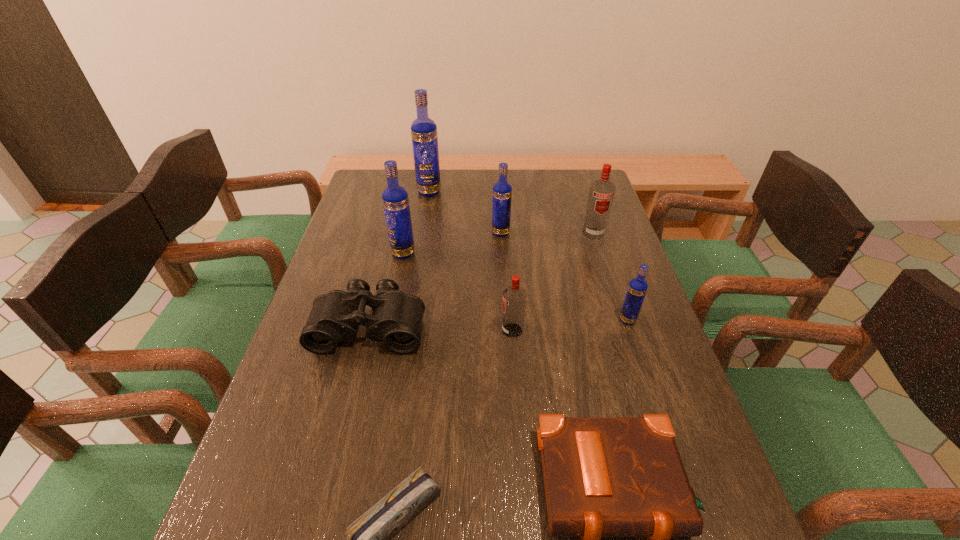
In order to click on free space between the third shortest object and the rightmost blue vodka in this screenshot , I will do `click(499, 323)`.

I want to click on unoccupied position between the smallest blue vodka and the farthest object, so (529, 255).

Find the location of a particular element. free space between the bigger red vodka and the fourth farthest object is located at coordinates (498, 243).

At what (x,y) coordinates should I click in order to perform the action: click on vacant area between the farthest object and the bigger red vodka. Please return your answer as a coordinate pair (x, y). Looking at the image, I should click on (512, 213).

Where is `object that is the fourth nearest to the second blue vodka from right to left`? object that is the fourth nearest to the second blue vodka from right to left is located at coordinates (396, 320).

You are a GUI agent. You are given a task and a screenshot of the screen. Output one action in this format:
    pyautogui.click(x=<x>, y=<y>)
    Task: Click on the object that is the nearest to the Bible
    Image resolution: width=960 pixels, height=540 pixels.
    Given the screenshot: What is the action you would take?
    368,539

Locate an element on the screen. This screenshot has height=540, width=960. vodka identified as the second closest to the binoculars is located at coordinates 514,297.

The height and width of the screenshot is (540, 960). Find the location of `vodka that is the third closest to the rightmost blue vodka`. vodka that is the third closest to the rightmost blue vodka is located at coordinates (502, 191).

Locate which blue vodka ranks in proximity to the tallest object. Please provide its 2D coordinates. Your answer should be formatted as a tuple, i.e. [(x, y)], where the tuple contains the x and y coordinates of a point satisfying the conditions above.

[(502, 191)]

Locate an element on the screen. This screenshot has height=540, width=960. the closest blue vodka relative to the third biggest blue vodka is located at coordinates (395, 199).